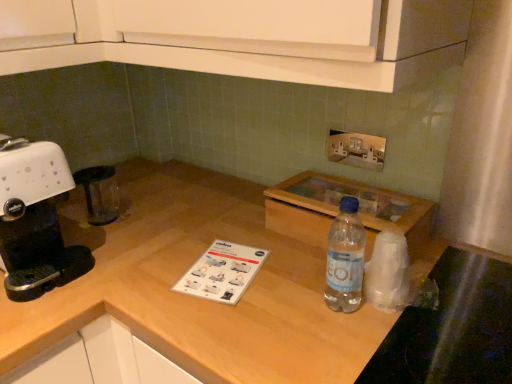
The width and height of the screenshot is (512, 384). In order to click on vacant space to the right of clear plastic bottle at center in this screenshot , I will do `click(437, 305)`.